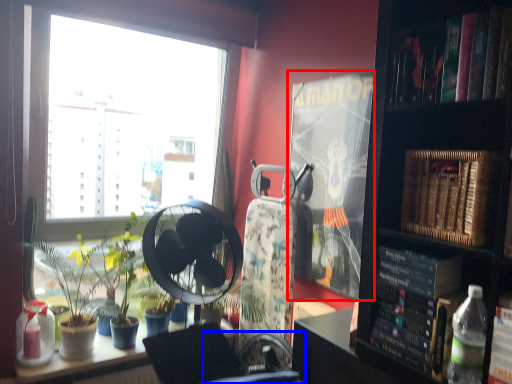
Question: Which of the following is the farthest to the observer, paperback book (highlighted by a red box) or swivel chair (highlighted by a blue box)?

Choices:
 (A) paperback book
 (B) swivel chair

Answer: (A)